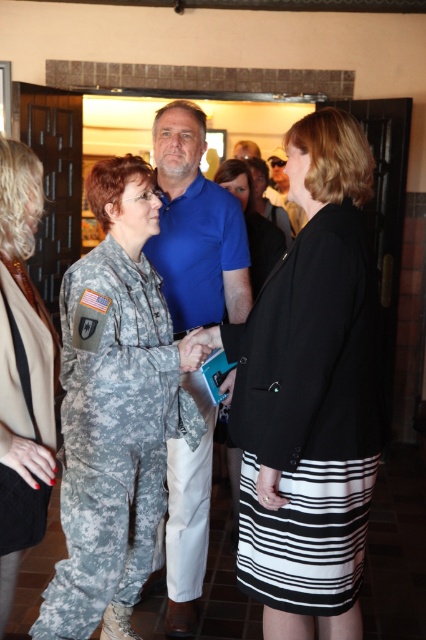
Consider the image. You are an interior designer who needs to place a new sofa in the room. The sofa will be placed at point 0.6, 0.7. Will the sofa interfere with the black matte blazer at center?

The black matte blazer at center is at point (310, 396), so placing the sofa at (298, 384) is very close but slightly to the left and lower than the blazer. There might be a slight interference depending on the sofa size, but the coordinates are near each other.

Looking at this image, you are a photographer at the event and want to ensure both the camouflage fabric skirt at center and the black fabric jacket at center are clearly visible in the photo. Based on their positions, which one is closer to the bottom of the frame?

The camouflage fabric skirt at center is below the black fabric jacket at center, so it is closer to the bottom of the frame.

You are a photographer positioned at the back of the room. You want to take a photo of the black fabric jacket at center without the camouflage uniform at center blocking it. Is this possible given their current positions?

The camouflage uniform at center is in front of the black fabric jacket at center, so it is blocking the view. Therefore, you cannot take a photo of the black fabric jacket at center without the camouflage uniform at center blocking it.